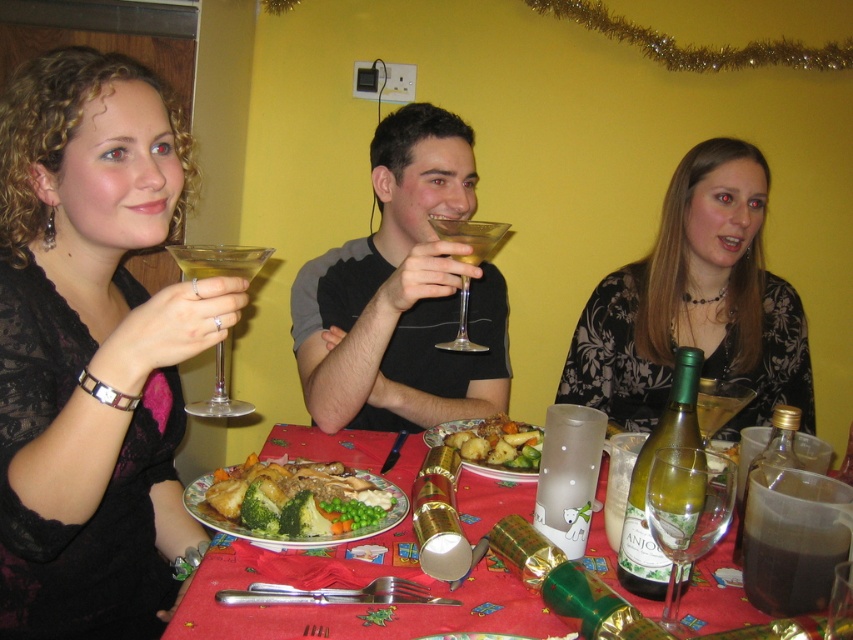
Is matte black shirt at center shorter than green glass bottle at center?

Incorrect, matte black shirt at center's height does not fall short of green glass bottle at center's.

Is matte black shirt at center to the left of green glass bottle at center from the viewer's perspective?

Indeed, matte black shirt at center is positioned on the left side of green glass bottle at center.

Where is `matte black shirt at center`? Image resolution: width=853 pixels, height=640 pixels. matte black shirt at center is located at coordinates pyautogui.click(x=402, y=294).

Locate an element on the screen. The image size is (853, 640). matte black shirt at center is located at coordinates (402, 294).

Who is higher up, green translucent wine glass at center or golden brown roasted potatoes at center?

golden brown roasted potatoes at center

Describe the element at coordinates (686, 513) in the screenshot. This screenshot has width=853, height=640. I see `green translucent wine glass at center` at that location.

At what (x,y) coordinates should I click in order to perform the action: click on green translucent wine glass at center. Please return your answer as a coordinate pair (x, y). Looking at the image, I should click on (686, 513).

Who is more distant from viewer, (49, 467) or (712, 401)?

Positioned behind is point (712, 401).

Is point (83, 182) positioned behind point (697, 394)?

No, it is not.

Is point (9, 328) farther from camera compared to point (746, 390)?

No, it is in front of (746, 390).

I want to click on matte black dress at left, so click(x=91, y=346).